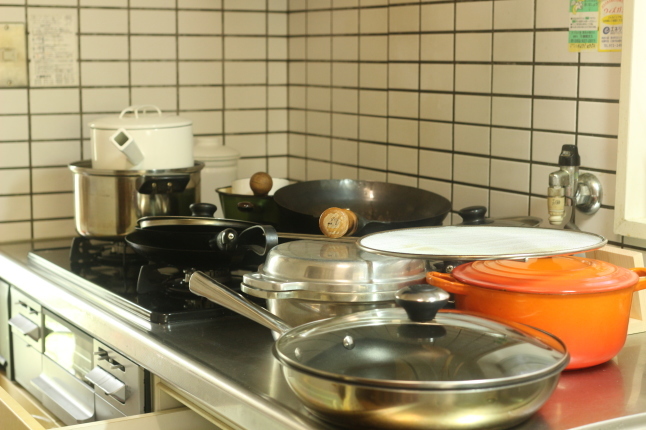
This screenshot has height=430, width=646. Find the location of `serving container`. serving container is located at coordinates (561, 310).